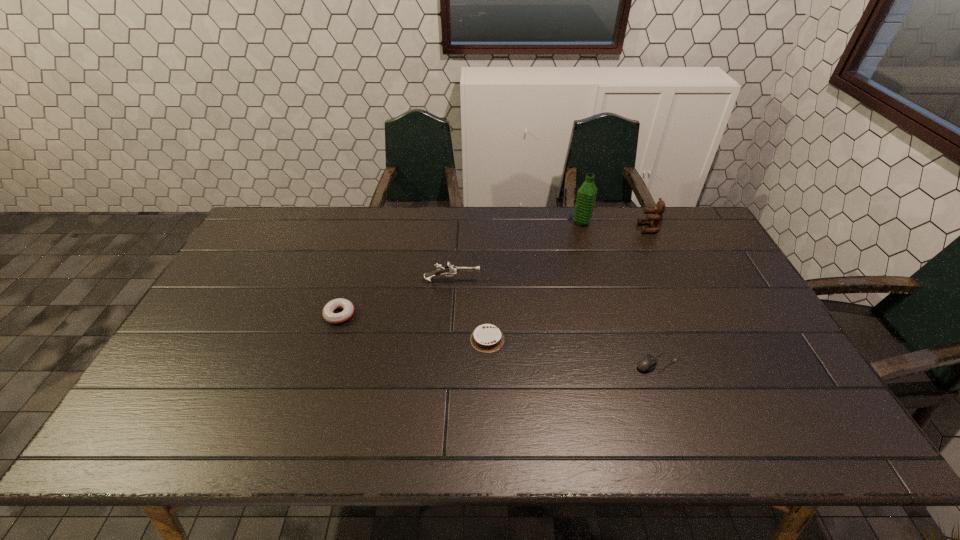
What are the coordinates of `water bottle` in the screenshot? It's located at tap(585, 201).

What are the coordinates of `teddy bear` in the screenshot? It's located at (655, 221).

At what (x,y) coordinates should I click in order to perform the action: click on the second tallest object. Please return your answer as a coordinate pair (x, y). Image resolution: width=960 pixels, height=540 pixels. Looking at the image, I should click on tap(655, 221).

Locate an element on the screen. the fourth shortest object is located at coordinates (449, 269).

Where is `gun`? The width and height of the screenshot is (960, 540). gun is located at coordinates (449, 269).

This screenshot has width=960, height=540. In order to click on the leftmost object in this screenshot , I will do `click(335, 318)`.

Identify the location of doughnut. (335, 318).

This screenshot has width=960, height=540. What are the coordinates of `chocolate cake` in the screenshot? It's located at (486, 338).

Identify the location of mouse. (647, 364).

The image size is (960, 540). Identify the location of free space located 0.220m on the left of the water bottle. (511, 222).